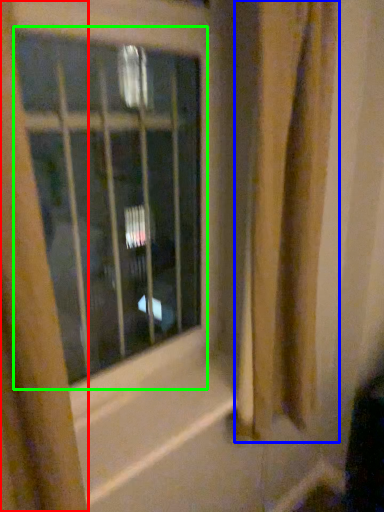
Question: Which object is positioned closest to curtain (highlighted by a red box)? Select from shower curtain (highlighted by a blue box) and window (highlighted by a green box).

Choices:
 (A) shower curtain
 (B) window

Answer: (A)